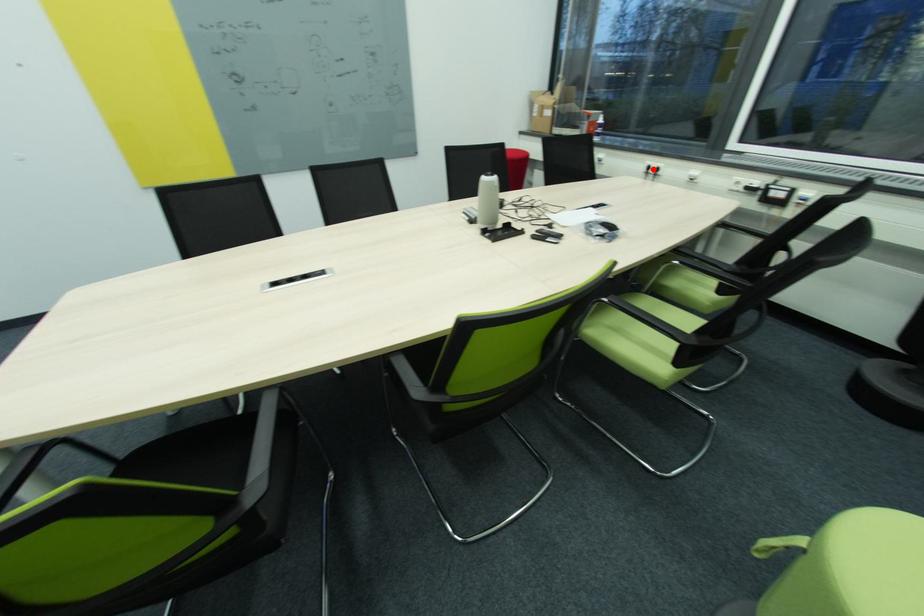
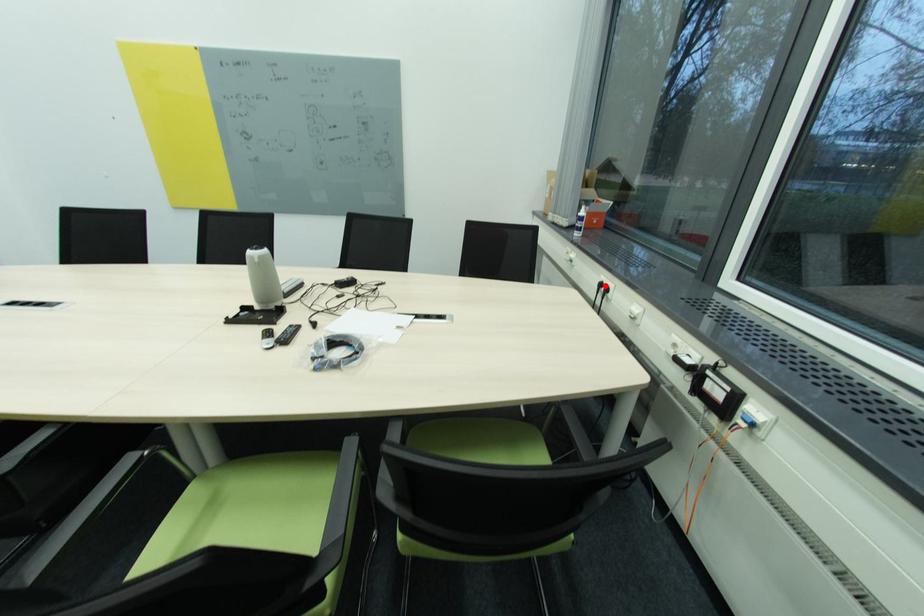
I am providing you with two images of the same scene from different viewpoints. A red point is marked on the first image and another point is marked on the second image. Are the points marked in image1 and image2 representing the same 3D position?

Yes